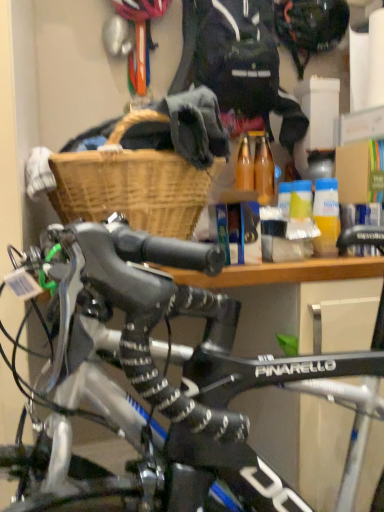
Question: Based on their sizes in the image, would you say yellow matte bottle at center is bigger or smaller than black matte helmet at upper center?

Choices:
 (A) big
 (B) small

Answer: (B)

Question: From a real-world perspective, is yellow matte bottle at center physically located above or below black matte helmet at upper center?

Choices:
 (A) above
 (B) below

Answer: (B)

Question: Estimate the real-world distances between objects in this image. Which object is closer to the woven wood basket at upper center?

Choices:
 (A) yellow matte bottle at center
 (B) dark blue fabric jacket at upper center
 (C) black matte helmet at upper center

Answer: (A)

Question: Based on their relative distances, which object is nearer to the yellow matte bottle at center?

Choices:
 (A) dark blue fabric jacket at upper center
 (B) black matte helmet at upper center
 (C) woven wood basket at upper center

Answer: (C)